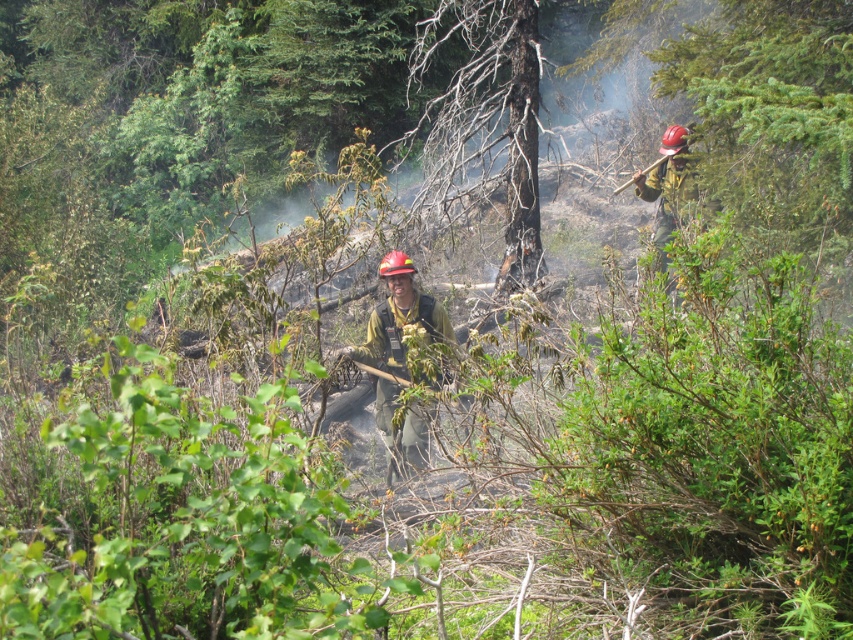
Question: Is matte green uniform at center closer to the viewer compared to hardened plastic helmet at upper right?

Choices:
 (A) no
 (B) yes

Answer: (B)

Question: Which of the following is the closest to the observer?

Choices:
 (A) hardened plastic helmet at upper right
 (B) matte green uniform at center

Answer: (B)

Question: Is matte green uniform at center closer to the viewer compared to hardened plastic helmet at upper right?

Choices:
 (A) no
 (B) yes

Answer: (B)

Question: Is matte green uniform at center to the right of hardened plastic helmet at upper right from the viewer's perspective?

Choices:
 (A) yes
 (B) no

Answer: (B)

Question: Which object is farther from the camera taking this photo?

Choices:
 (A) hardened plastic helmet at upper right
 (B) matte green uniform at center

Answer: (A)